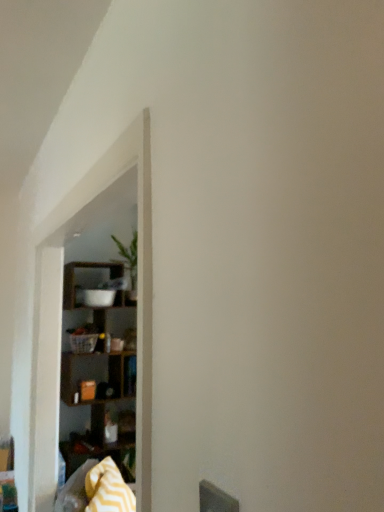
Question: From the image's perspective, is wooden shelf at left positioned above or below wooden shelf at center?

Choices:
 (A) above
 (B) below

Answer: (B)

Question: From a real-world perspective, is wooden shelf at left physically located above or below wooden shelf at center?

Choices:
 (A) below
 (B) above

Answer: (A)

Question: Which object is the closest to the wooden shelf at center?

Choices:
 (A) green leafy plant at upper center
 (B) yellow zigzag blanket at lower left
 (C) wooden shelf at left

Answer: (B)

Question: Which object is positioned closest to the yellow zigzag blanket at lower left?

Choices:
 (A) wooden shelf at center
 (B) wooden shelf at left
 (C) green leafy plant at upper center

Answer: (A)